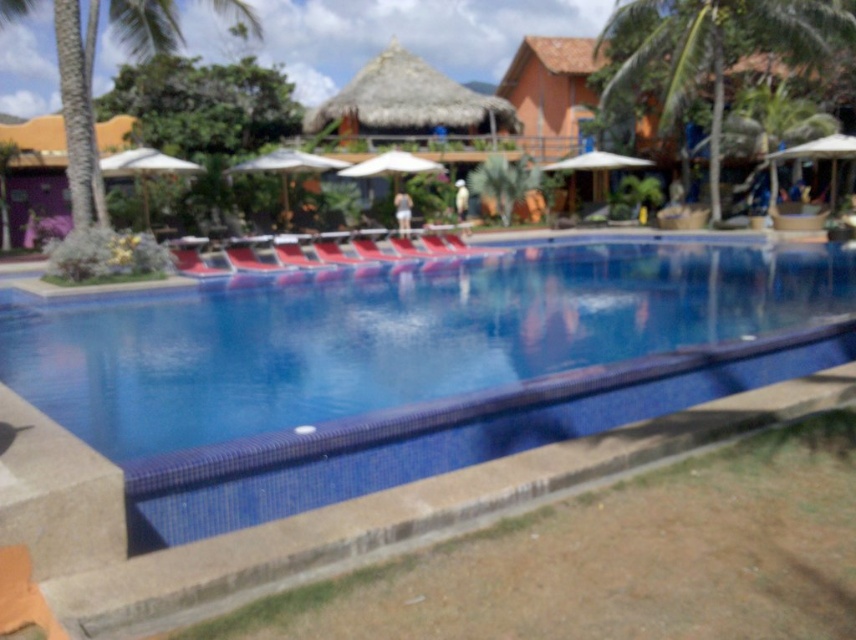
Consider the image. You are standing at the entrance of the resort pool area and want to locate the blue glossy pool at center. According to the coordinates provided, where should you look?

You should look at point (x=357, y=28) to find the blue glossy pool at center.

You are a guest at the resort and want to take a photo of both the blue glossy pool at center and the red fabric daybed at center. Since you want both to be in focus, which object should you position closer to the camera to ensure they are both clearly visible?

The blue glossy pool at center is taller than the red fabric daybed at center. To ensure both are in focus, position the red fabric daybed at center closer to the camera so that the distance between them is minimized.

You are planning to install a new lighting fixture above the red fabric daybed at center. Considering the height of the green leafy palm tree at upper left, will the light fixture interfere with the tree?

The green leafy palm tree at upper left is much taller than the red fabric daybed at center, so the lighting fixture above the daybed will not interfere with the tree as it is shorter than the tree.